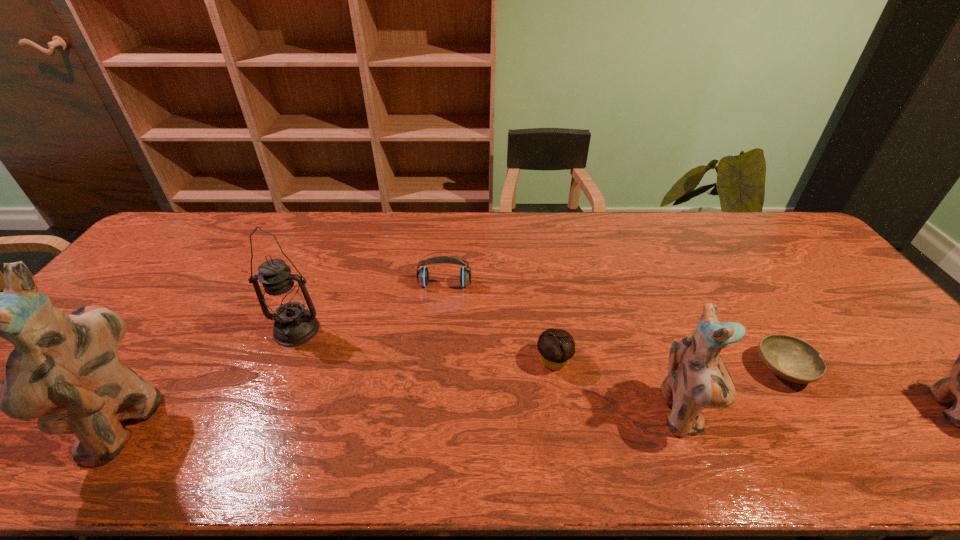
Identify the location of free spot that satisfies the following two spatial constraints: 1. on the ear cups of the fourth object from left to right; 2. on the right side of the farthest object. The height and width of the screenshot is (540, 960). (438, 361).

Where is `free space that satisfies the following two spatial constraints: 1. on the front side of the oil lamp; 2. on the front-facing side of the tallest figurine`? This screenshot has height=540, width=960. free space that satisfies the following two spatial constraints: 1. on the front side of the oil lamp; 2. on the front-facing side of the tallest figurine is located at coordinates point(257,423).